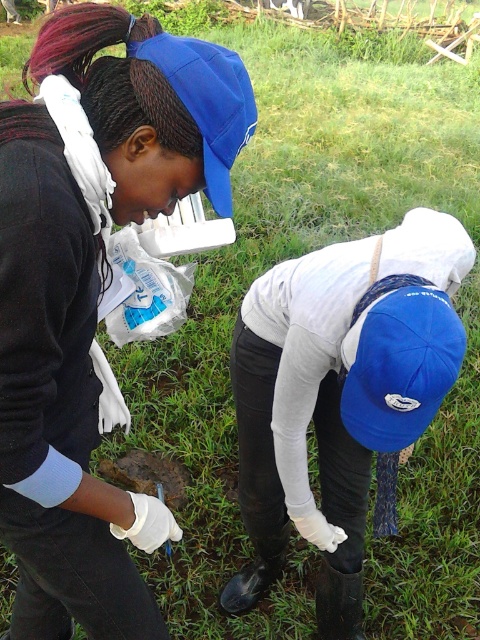
Who is shorter, white matte gloves at lower center or blue fabric baseball cap at lower center?

blue fabric baseball cap at lower center

Can you confirm if white matte gloves at lower center is positioned above blue fabric baseball cap at lower center?

No.

Does point (292, 428) come in front of point (379, 406)?

No, it is not.

I want to click on white matte gloves at lower center, so click(338, 394).